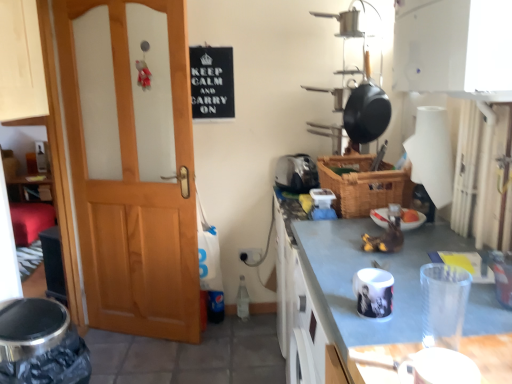
I want to click on free spot in front of clear plastic bottle at lower center, so click(252, 335).